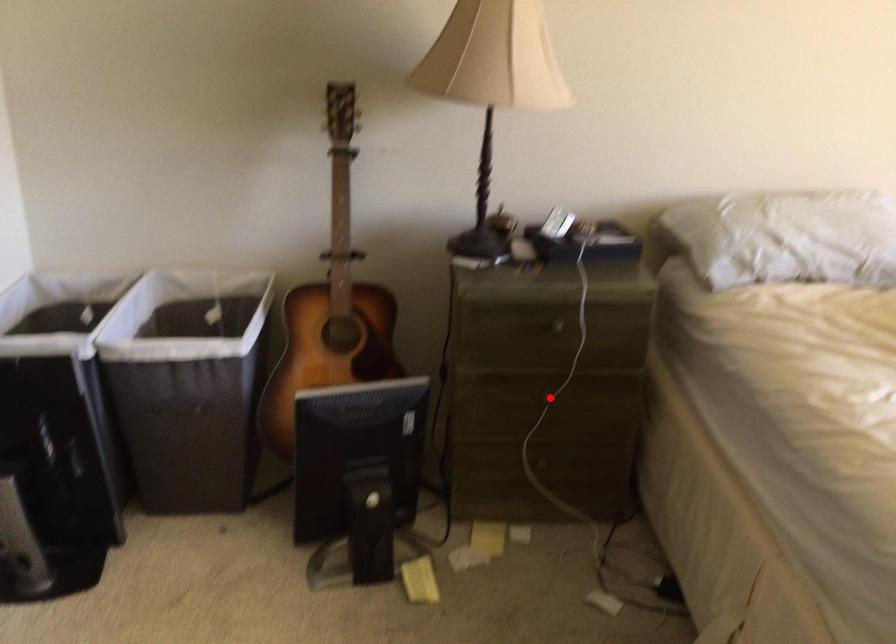
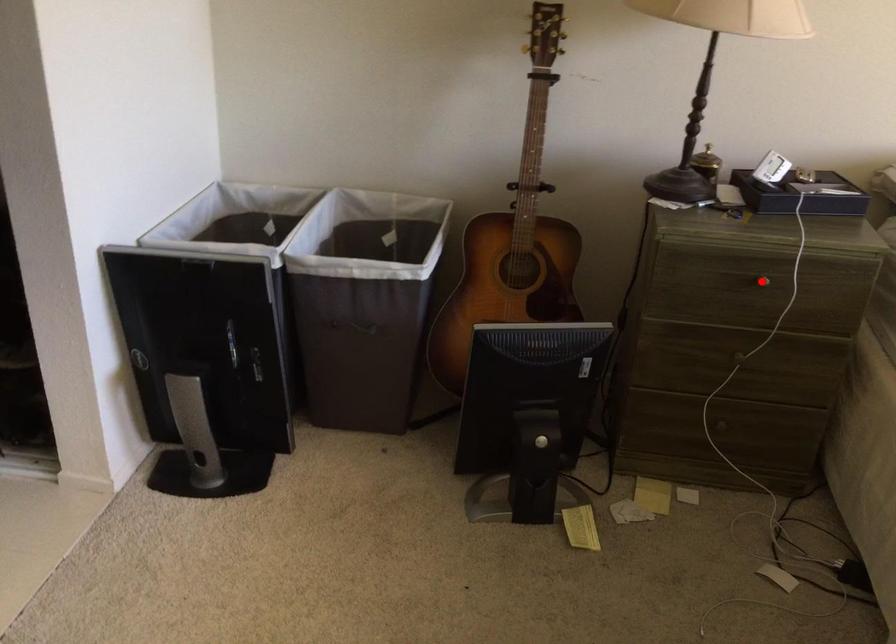
From the picture: I am providing you with two images of the same scene from different viewpoints. A red point is marked on the first image and another point is marked on the second image. Are the points marked in image1 and image2 representing the same 3D position?

No